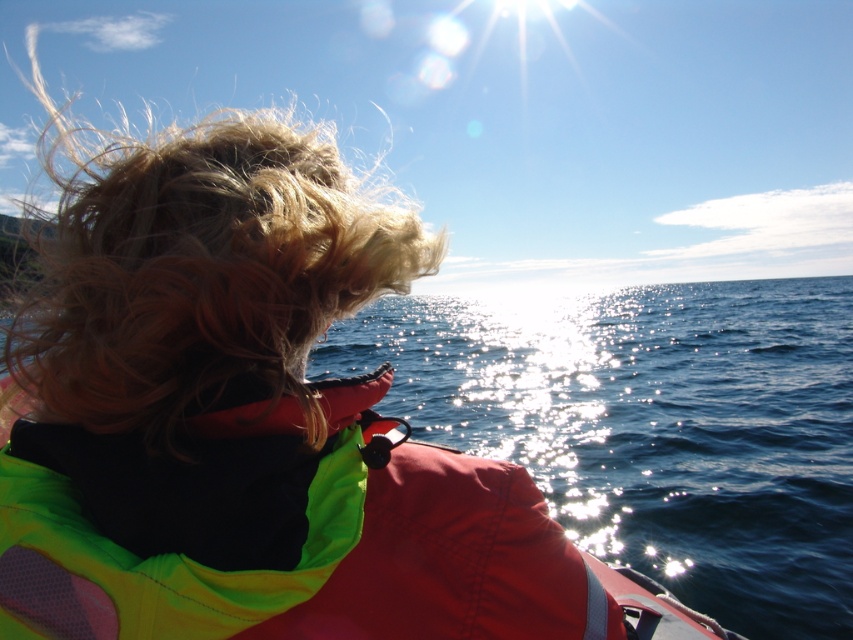
Can you confirm if glistening blue water at center is taller than blonde hair at upper left?

Yes.

Can you confirm if glistening blue water at center is smaller than blonde hair at upper left?

No, glistening blue water at center is not smaller than blonde hair at upper left.

Locate an element on the screen. The width and height of the screenshot is (853, 640). glistening blue water at center is located at coordinates (653, 426).

Who is more distant from viewer, [561,387] or [67,518]?

Positioned behind is point [561,387].

This screenshot has height=640, width=853. What do you see at coordinates (653, 426) in the screenshot? I see `glistening blue water at center` at bounding box center [653, 426].

You are a GUI agent. You are given a task and a screenshot of the screen. Output one action in this format:
    pyautogui.click(x=<x>, y=<y>)
    Task: Click on the glistening blue water at center
    The width and height of the screenshot is (853, 640).
    Given the screenshot: What is the action you would take?
    pyautogui.click(x=653, y=426)

Can you confirm if blonde hair at upper left is taller than neon green/yellow fabric life jacket at upper left?

Yes.

Who is more distant from viewer, [286,349] or [350,406]?

Positioned behind is point [286,349].

I want to click on blonde hair at upper left, so click(x=199, y=272).